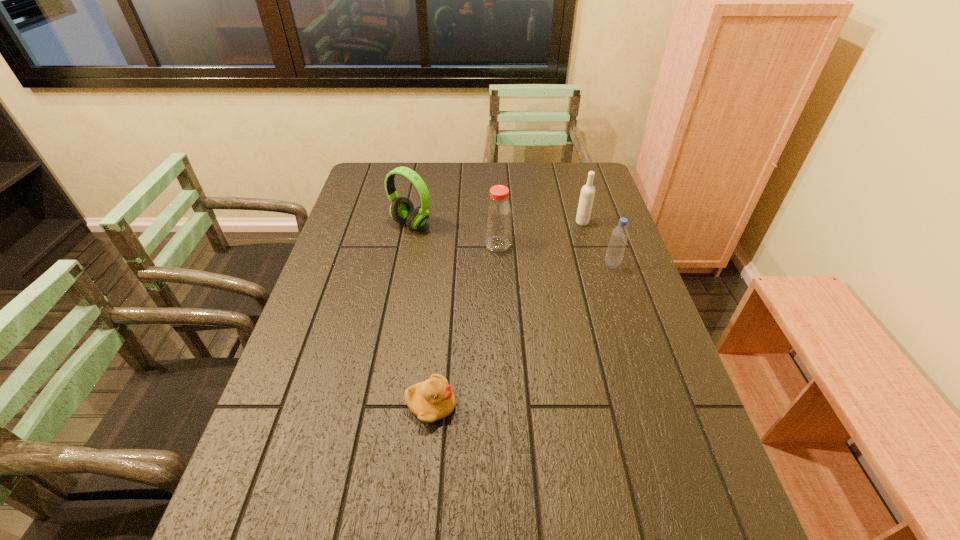
The width and height of the screenshot is (960, 540). I want to click on vacant space in between the shortest object and the headset, so click(x=421, y=315).

Find the location of `vacant region between the vodka and the taller bottle`. vacant region between the vodka and the taller bottle is located at coordinates (540, 233).

Find the location of a particular element. unoccupied position between the second shortest object and the headset is located at coordinates (512, 244).

This screenshot has height=540, width=960. I want to click on vacant area that lies between the shortest object and the second nearest object, so click(521, 335).

Identify the location of unoccupied position between the nearer bottle and the headset. The image size is (960, 540). (512, 244).

Identify which object is the third nearest to the headset. Please provide its 2D coordinates. Your answer should be formatted as a tuple, i.e. [(x, y)], where the tuple contains the x and y coordinates of a point satisfying the conditions above.

[(619, 236)]

Identify the location of object that is the fourth closest to the headset. (433, 399).

This screenshot has height=540, width=960. I want to click on free point that satisfies the following two spatial constraints: 1. on the back side of the headset; 2. on the right side of the fourth object from left to right, so click(x=412, y=222).